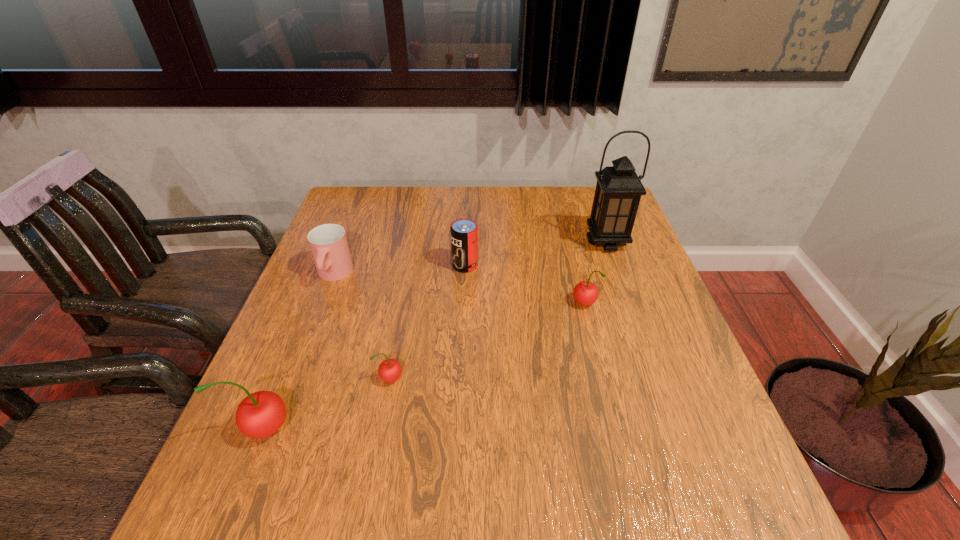
The image size is (960, 540). In order to click on vacant spot for a new cherry to ensure equal spacing in this screenshot , I will do `click(495, 339)`.